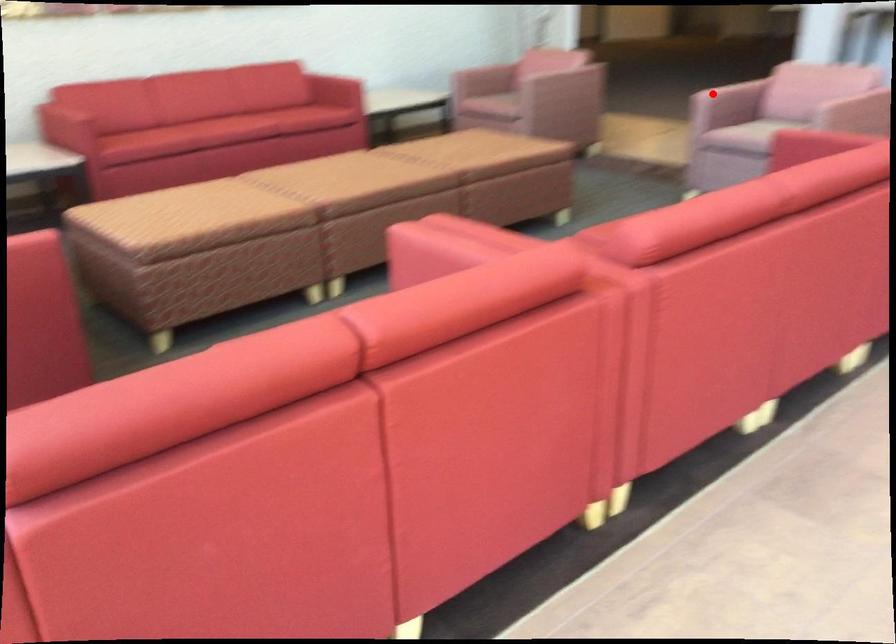
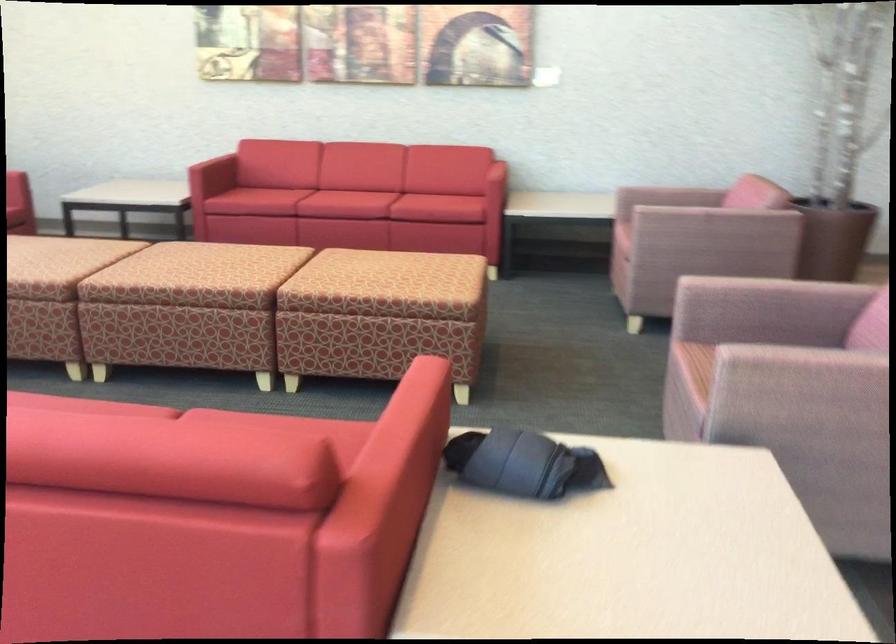
Question: A red point is marked in image1. In image2, is the corresponding 3D point closer to the camera or farther? Reply with the corresponding letter.

Choices:
 (A) The corresponding 3D point is closer.
 (B) The corresponding 3D point is farther.

Answer: (A)